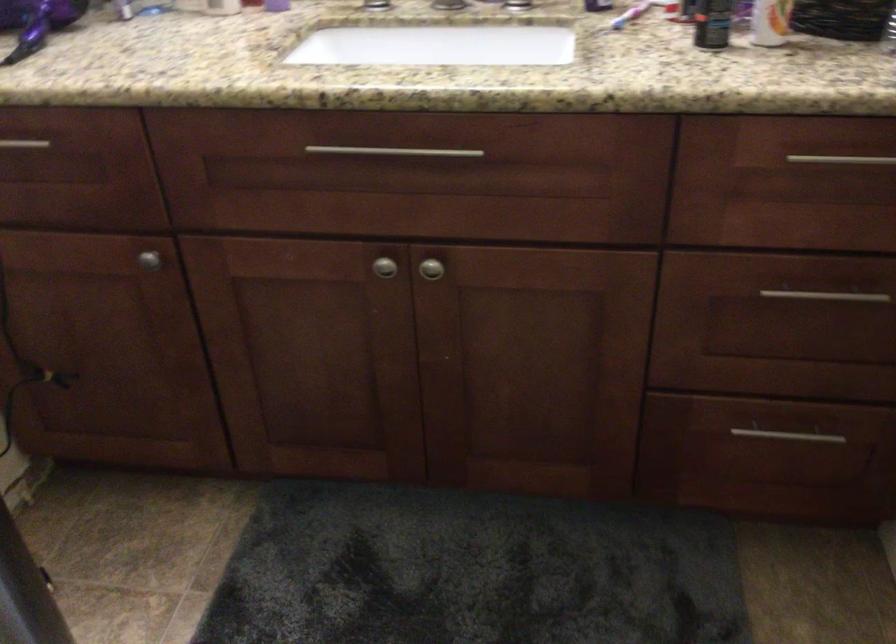
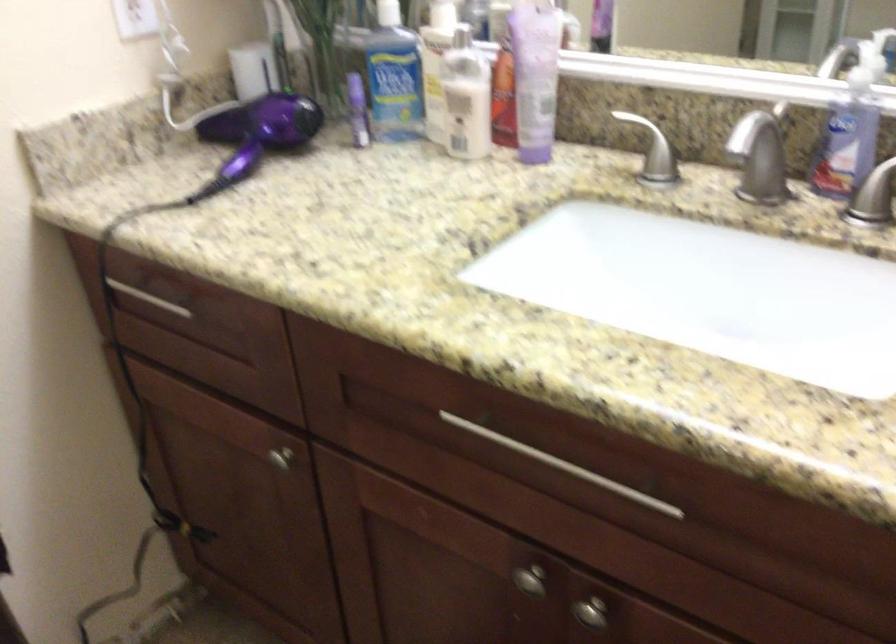
Question: The camera is either moving clockwise (left) or counter-clockwise (right) around the object. The first image is from the beginning of the video and the second image is from the end. Is the camera moving left or right when shooting the video?

Choices:
 (A) Left
 (B) Right

Answer: (B)